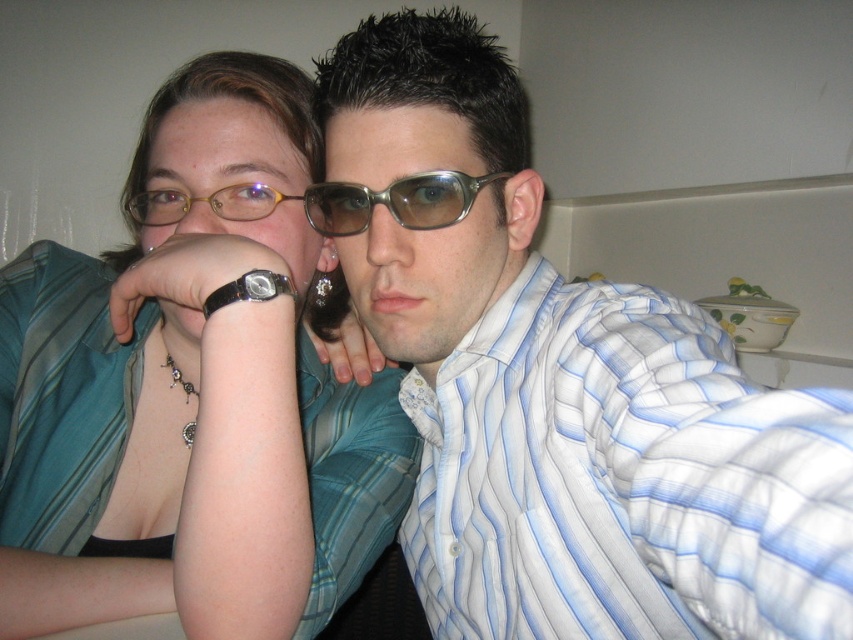
From the picture: You are a photographer adjusting the focus on your camera. You notice two pairs of glasses in the scene. The metallic frame glasses at center and the gold plastic glasses at upper center. Which pair is closer to the camera?

The metallic frame glasses at center is closer to the camera since it is only 3.26 inches away from the gold plastic glasses at upper center, indicating proximity in the depth of field.

Based on the photo, you are a photographer trying to adjust the lighting in the studio. You notice the matte blue striped shirt at center and the gold plastic glasses at upper center. Which object is positioned lower in the image?

The matte blue striped shirt at center is below gold plastic glasses at upper center, so the shirt is lower than the glasses.

You are a photographer who needs to adjust the lighting between the two subjects in the image. The subjects are wearing the matte blue striped shirt at center and the matte teal blouse at center. According to the scene, how far apart are these two clothing items?

The matte blue striped shirt at center and the matte teal blouse at center are 14.28 centimeters apart.